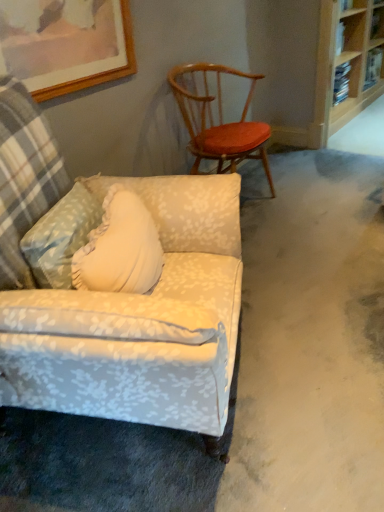
Question: From a real-world perspective, is floral fabric armchair at lower left, which is the 2th chair in back-to-front order, positioned under wooden bookshelf at upper right based on gravity?

Choices:
 (A) yes
 (B) no

Answer: (A)

Question: Is floral fabric armchair at lower left, which is the 2th chair in back-to-front order, smaller than wooden bookshelf at upper right?

Choices:
 (A) yes
 (B) no

Answer: (A)

Question: From a real-world perspective, does floral fabric armchair at lower left, which appears as the first chair when viewed from the front, stand above wooden bookshelf at upper right?

Choices:
 (A) no
 (B) yes

Answer: (A)

Question: Can you confirm if floral fabric armchair at lower left, which appears as the first chair when viewed from the front, is shorter than wooden bookshelf at upper right?

Choices:
 (A) yes
 (B) no

Answer: (A)

Question: Is floral fabric armchair at lower left, which appears as the first chair when viewed from the front, taller than wooden bookshelf at upper right?

Choices:
 (A) no
 (B) yes

Answer: (A)

Question: In terms of height, does wooden bookshelf at upper right look taller or shorter compared to wooden spindles chair at upper right, which appears as the first chair when viewed from the back?

Choices:
 (A) tall
 (B) short

Answer: (A)

Question: In terms of width, does wooden bookshelf at upper right look wider or thinner when compared to wooden spindles chair at upper right, which is counted as the 2th chair, starting from the front?

Choices:
 (A) wide
 (B) thin

Answer: (B)

Question: Looking at the image, does wooden bookshelf at upper right seem bigger or smaller compared to wooden spindles chair at upper right, which is counted as the 2th chair, starting from the front?

Choices:
 (A) big
 (B) small

Answer: (A)

Question: Is wooden bookshelf at upper right in front of or behind wooden spindles chair at upper right, which appears as the first chair when viewed from the back, in the image?

Choices:
 (A) behind
 (B) front

Answer: (A)

Question: From a real-world perspective, relative to wooden spindles chair at upper right, which appears as the first chair when viewed from the back, is wooden picture frame at upper left vertically above or below?

Choices:
 (A) above
 (B) below

Answer: (A)

Question: Considering the positions of wooden picture frame at upper left and wooden spindles chair at upper right, which is counted as the 2th chair, starting from the front, in the image, is wooden picture frame at upper left bigger or smaller than wooden spindles chair at upper right, which is counted as the 2th chair, starting from the front,?

Choices:
 (A) big
 (B) small

Answer: (B)

Question: Is wooden picture frame at upper left taller or shorter than wooden spindles chair at upper right, which appears as the first chair when viewed from the back?

Choices:
 (A) tall
 (B) short

Answer: (B)

Question: Choose the correct answer: Is wooden picture frame at upper left inside wooden spindles chair at upper right, which appears as the first chair when viewed from the back, or outside it?

Choices:
 (A) outside
 (B) inside

Answer: (A)

Question: Visually, is floral fabric armchair at lower left, which is the 2th chair in back-to-front order, positioned to the left or to the right of wooden bookshelf at upper right?

Choices:
 (A) left
 (B) right

Answer: (A)

Question: Is point (228, 307) positioned closer to the camera than point (324, 31)?

Choices:
 (A) closer
 (B) farther

Answer: (A)